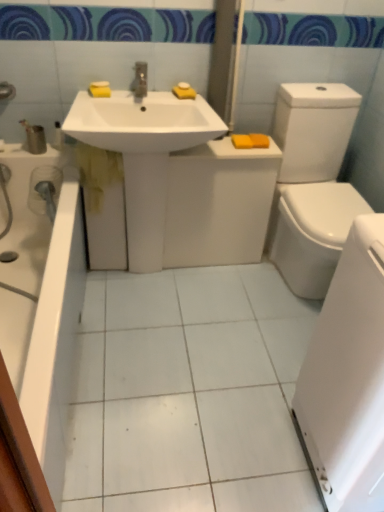
In order to face orange matte bar of soap at upper right, marked as the second soap in a right-to-left arrangement, should I rotate leftwards or rightwards?

A 6.819 degree turn to the right will do.

Locate an element on the screen. Image resolution: width=384 pixels, height=512 pixels. matte silver faucet at center is located at coordinates (140, 80).

Does yellow sponge at upper center, the fourth soap positioned from the right, have a smaller size compared to yellow matte soap at right, the fifth soap from the left?

Indeed, yellow sponge at upper center, the fourth soap positioned from the right, has a smaller size compared to yellow matte soap at right, the fifth soap from the left.

Based on the photo, from the image's perspective, which one is positioned lower, yellow sponge at upper center, acting as the 2th soap starting from the left, or yellow matte soap at right, the fifth soap from the left?

yellow matte soap at right, the fifth soap from the left, is shown below in the image.

Which object is further away from the camera taking this photo, yellow sponge at upper center, acting as the 2th soap starting from the left, or yellow matte soap at right, the fifth soap from the left?

yellow matte soap at right, the fifth soap from the left, is further away from the camera.

Locate an element on the screen. The image size is (384, 512). soap that is the 3rd object located in front of the yellow matte soap at right, marked as the first soap in a right-to-left arrangement is located at coordinates (184, 91).

Can you tell me how much yellow sponge at upper center, the fourth soap positioned from the right, and yellow sponge at upper center, arranged as the third soap when viewed from the left, differ in facing direction?

0.000108 degrees.

Are yellow sponge at upper center, the fourth soap positioned from the right, and yellow sponge at upper center, arranged as the third soap when viewed from the left, making contact?

Yes, yellow sponge at upper center, the fourth soap positioned from the right, is beside yellow sponge at upper center, arranged as the third soap when viewed from the left.

Which of these two, yellow sponge at upper center, acting as the 2th soap starting from the left, or yellow sponge at upper center, which is the third soap from right to left, is bigger?

With larger size is yellow sponge at upper center, acting as the 2th soap starting from the left.

Is yellow sponge at upper center, acting as the 2th soap starting from the left, oriented towards yellow sponge at upper center, arranged as the third soap when viewed from the left?

No, yellow sponge at upper center, acting as the 2th soap starting from the left, is not facing towards yellow sponge at upper center, arranged as the third soap when viewed from the left.

Looking at their sizes, would you say matte silver faucet at center is wider or thinner than yellow sponge at upper left, the 5th soap in the right-to-left sequence?

In the image, matte silver faucet at center appears to be wider than yellow sponge at upper left, the 5th soap in the right-to-left sequence.

Looking at this image, considering the relative sizes of matte silver faucet at center and yellow sponge at upper left, acting as the 1th soap starting from the left, in the image provided, is matte silver faucet at center shorter than yellow sponge at upper left, acting as the 1th soap starting from the left,?

In fact, matte silver faucet at center may be taller than yellow sponge at upper left, acting as the 1th soap starting from the left.

From the image's perspective, which is below, matte silver faucet at center or yellow sponge at upper left, acting as the 1th soap starting from the left?

yellow sponge at upper left, acting as the 1th soap starting from the left.

The width and height of the screenshot is (384, 512). Find the location of `the 2nd soap located beneath the matte silver faucet at center (from a real-world perspective)`. the 2nd soap located beneath the matte silver faucet at center (from a real-world perspective) is located at coordinates (99, 89).

Consider the image. Could you tell me if white glossy bathtub at lower left is turned towards matte silver faucet at center?

No, white glossy bathtub at lower left is not oriented towards matte silver faucet at center.

From the image's perspective, is white glossy bathtub at lower left located above matte silver faucet at center?

No, from the image's perspective, white glossy bathtub at lower left is not on top of matte silver faucet at center.

Looking at this image, which object is wider, white glossy bathtub at lower left or matte silver faucet at center?

white glossy bathtub at lower left.

From the image's perspective, is yellow sponge at upper center, arranged as the third soap when viewed from the left, above matte silver faucet at center?

Correct, yellow sponge at upper center, arranged as the third soap when viewed from the left, appears higher than matte silver faucet at center in the image.

Between yellow sponge at upper center, arranged as the third soap when viewed from the left, and matte silver faucet at center, which one has less height?

yellow sponge at upper center, arranged as the third soap when viewed from the left, is shorter.

Is yellow sponge at upper center, arranged as the third soap when viewed from the left, far from matte silver faucet at center?

No, yellow sponge at upper center, arranged as the third soap when viewed from the left, is not far away from matte silver faucet at center.

Does yellow sponge at upper left, acting as the 1th soap starting from the left, come in front of white glossy sink at center?

No, yellow sponge at upper left, acting as the 1th soap starting from the left, is further to the viewer.

Is yellow sponge at upper left, acting as the 1th soap starting from the left, outside of white glossy sink at center?

Yes, yellow sponge at upper left, acting as the 1th soap starting from the left, is outside of white glossy sink at center.

Is yellow sponge at upper left, the 5th soap in the right-to-left sequence, facing away from white glossy sink at center?

That's not correct — yellow sponge at upper left, the 5th soap in the right-to-left sequence, is not looking away from white glossy sink at center.

In terms of height, does yellow sponge at upper left, acting as the 1th soap starting from the left, look taller or shorter compared to white glossy sink at center?

yellow sponge at upper left, acting as the 1th soap starting from the left, is shorter than white glossy sink at center.

Based on the photo, which of these two, yellow sponge at upper left, the 5th soap in the right-to-left sequence, or white glossy bathtub at lower left, is smaller?

yellow sponge at upper left, the 5th soap in the right-to-left sequence, is smaller.

Considering the sizes of objects yellow sponge at upper left, acting as the 1th soap starting from the left, and white glossy bathtub at lower left in the image provided, who is taller, yellow sponge at upper left, acting as the 1th soap starting from the left, or white glossy bathtub at lower left?

Standing taller between the two is white glossy bathtub at lower left.

Looking at this image, are yellow sponge at upper left, the 5th soap in the right-to-left sequence, and white glossy bathtub at lower left located far from each other?

Actually, yellow sponge at upper left, the 5th soap in the right-to-left sequence, and white glossy bathtub at lower left are a little close together.

You are a GUI agent. You are given a task and a screenshot of the screen. Output one action in this format:
    pyautogui.click(x=<x>, y=<y>)
    Task: Click on the soap that is the 3rd object to the right of the yellow sponge at upper center, the fourth soap positioned from the right, starting at the anchor
    
    Given the screenshot: What is the action you would take?
    pyautogui.click(x=259, y=140)

The image size is (384, 512). What are the coordinates of `soap that is the 2nd object above the yellow sponge at upper center, acting as the 2th soap starting from the left (from a real-world perspective)` in the screenshot? It's located at (183, 85).

Based on their spatial positions, is white glossy bathtub at lower left or yellow sponge at upper center, acting as the 2th soap starting from the left, further from orange matte bar of soap at upper right, marked as the second soap in a right-to-left arrangement?

white glossy bathtub at lower left is further to orange matte bar of soap at upper right, marked as the second soap in a right-to-left arrangement.

Looking at the image, which one is located further to matte silver faucet at center, white glossy towel at lower right or orange matte bar of soap at upper right, marked as the second soap in a right-to-left arrangement?

white glossy towel at lower right is positioned further to the anchor matte silver faucet at center.

Estimate the real-world distances between objects in this image. Which object is further from white glossy sink at center, white glossy bathtub at lower left or white glossy towel at lower right?

Based on the image, white glossy towel at lower right appears to be further to white glossy sink at center.

Based on their spatial positions, is white glossy bathtub at lower left or white glossy sink at center further from matte silver faucet at center?

white glossy bathtub at lower left.

Looking at the image, which one is located closer to yellow sponge at upper left, the 5th soap in the right-to-left sequence, white glossy towel at lower right or white glossy sink at center?

white glossy sink at center is positioned closer to the anchor yellow sponge at upper left, the 5th soap in the right-to-left sequence.

Based on their spatial positions, is white glossy bathtub at lower left or orange matte bar of soap at upper right, marked as the second soap in a right-to-left arrangement, further from white glossy sink at center?

white glossy bathtub at lower left is positioned further to the anchor white glossy sink at center.

Considering their positions, is white glossy bathtub at lower left positioned further to yellow sponge at upper center, arranged as the third soap when viewed from the left, than yellow sponge at upper center, the fourth soap positioned from the right?

white glossy bathtub at lower left lies further to yellow sponge at upper center, arranged as the third soap when viewed from the left, than the other object.

Which object lies further to the anchor point white glossy sink at center, yellow matte soap at right, marked as the first soap in a right-to-left arrangement, or white glossy towel at lower right?

Among the two, white glossy towel at lower right is located further to white glossy sink at center.

Where is `tap between yellow sponge at upper left, acting as the 1th soap starting from the left, and yellow sponge at upper center, which is the third soap from right to left, in the horizontal direction`? The image size is (384, 512). tap between yellow sponge at upper left, acting as the 1th soap starting from the left, and yellow sponge at upper center, which is the third soap from right to left, in the horizontal direction is located at coordinates (140, 80).

This screenshot has width=384, height=512. I want to click on tap between yellow sponge at upper left, the 5th soap in the right-to-left sequence, and yellow sponge at upper center, acting as the 2th soap starting from the left, in the horizontal direction, so click(x=140, y=80).

The width and height of the screenshot is (384, 512). I want to click on sink between yellow sponge at upper left, acting as the 1th soap starting from the left, and white glossy towel at lower right from top to bottom, so click(x=142, y=122).

The width and height of the screenshot is (384, 512). In order to click on tap between yellow sponge at upper center, which is the third soap from right to left, and white glossy towel at lower right from top to bottom in this screenshot , I will do `click(140, 80)`.